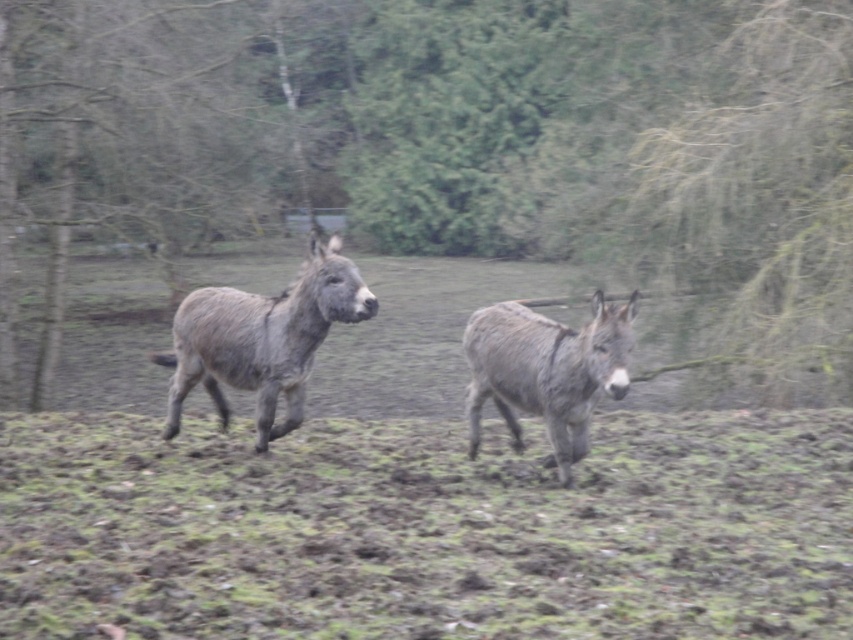
Consider the image. You are standing at the origin point in the image. There is a green leafy tree at center represented by point (451, 138). Can you tell me the coordinates of the green leafy tree at center?

The green leafy tree at center is represented by point (451, 138).

From the picture: You are a hiker trying to reach the green leafy tree at center from the gray rough fur mule at center. Which direction should you move relative to the mule?

The green leafy tree at center is located above the gray rough fur mule at center, so you should move upward relative to the mule to reach the tree.

You are a hiker trying to cross the muddy field. You see the green grass at center and the gray rough fur mule at center. Which object is positioned to the left of the other?

The green grass at center is to the left of the gray rough fur mule at center according to the description.